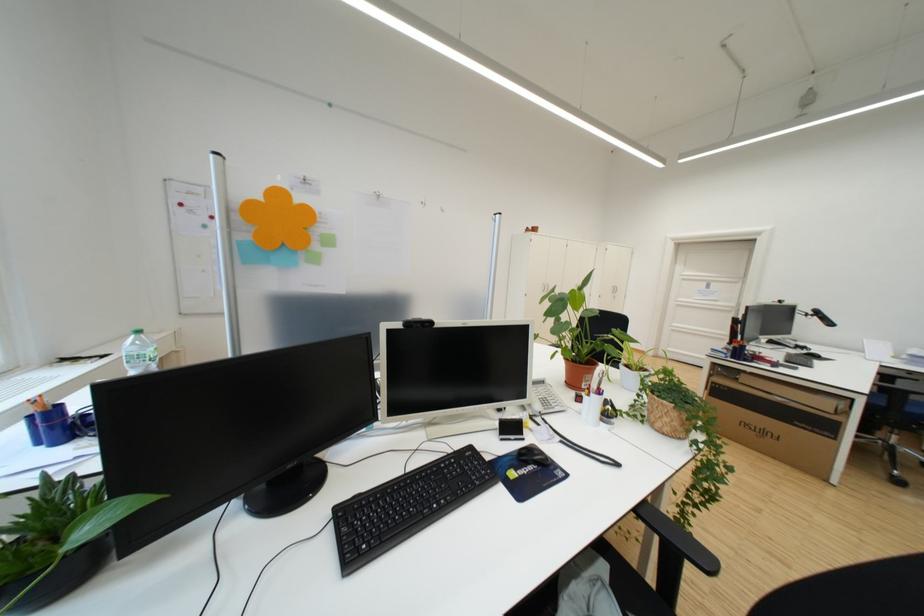
The image size is (924, 616). Find the location of `plastic water bottle`. plastic water bottle is located at coordinates (139, 353).